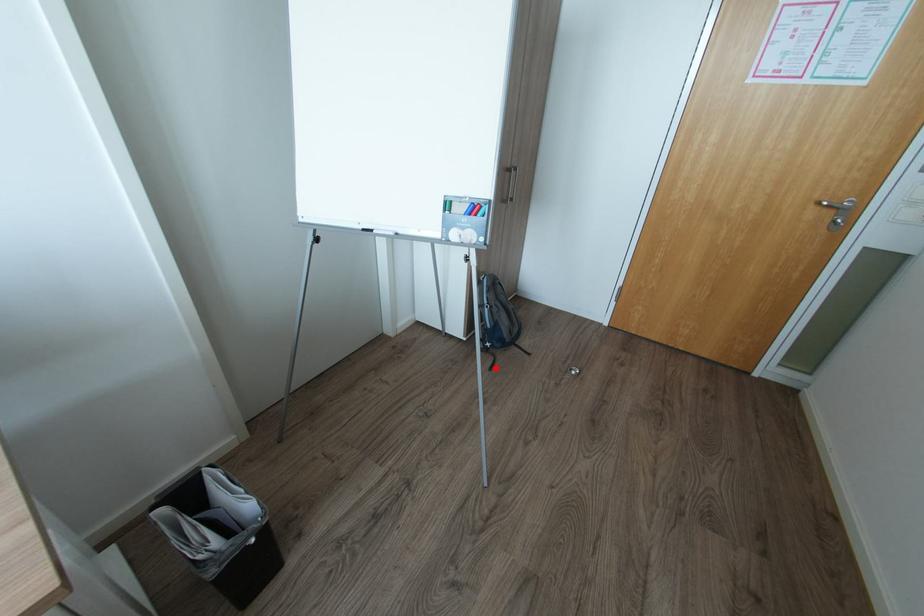
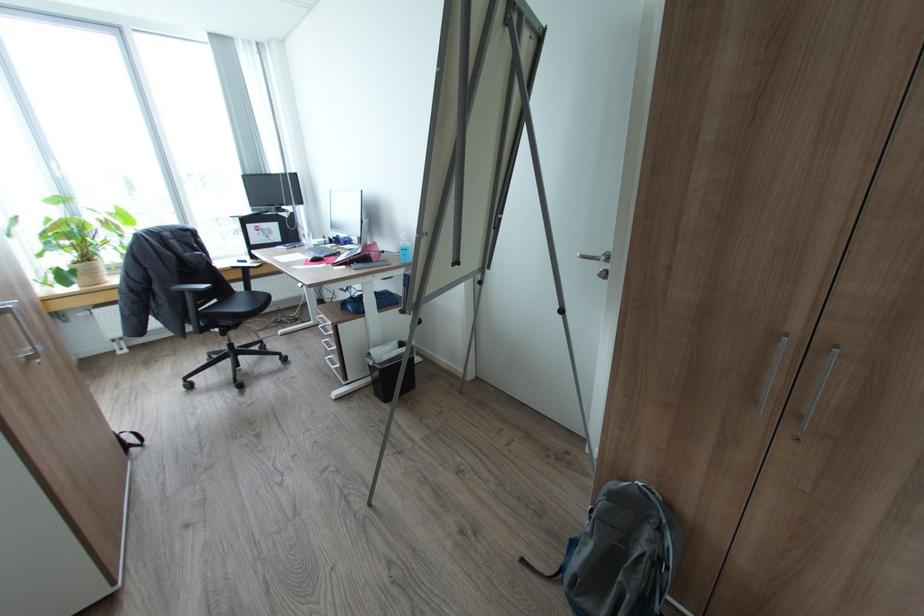
Where in the second image is the point corresponding to the highlighted location from the first image?

(527, 560)